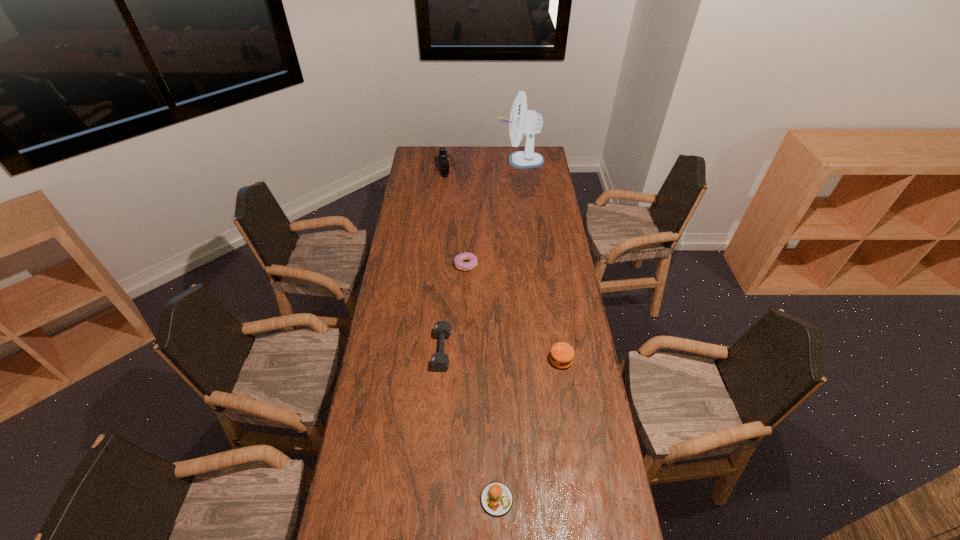
Where is `blank space located 0.300m on the grille of the fan`? The height and width of the screenshot is (540, 960). blank space located 0.300m on the grille of the fan is located at coordinates (445, 160).

What are the coordinates of `vacant region located 0.060m on the right of the second tallest object` in the screenshot? It's located at (466, 166).

Locate an element on the screen. Image resolution: width=960 pixels, height=540 pixels. free space located on the left of the farther patty is located at coordinates (452, 360).

This screenshot has width=960, height=540. Find the location of `vacant space located on the right of the dumbbell`. vacant space located on the right of the dumbbell is located at coordinates (524, 350).

The width and height of the screenshot is (960, 540). I want to click on vacant space located on the back of the doughnut, so click(x=468, y=223).

What are the coordinates of `vacant space located on the back of the nearest object` in the screenshot? It's located at (494, 420).

Find the location of a particular element. The image size is (960, 540). fan located in the far edge section of the desktop is located at coordinates (522, 121).

Image resolution: width=960 pixels, height=540 pixels. What are the coordinates of `binoculars situated at the far edge` in the screenshot? It's located at (444, 162).

The width and height of the screenshot is (960, 540). I want to click on object located at the left edge, so click(444, 162).

Where is `fan that is at the right edge`? This screenshot has height=540, width=960. fan that is at the right edge is located at coordinates (522, 121).